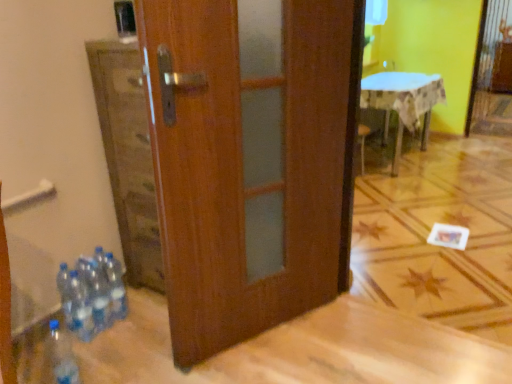
Question: Does clear plastic bottles at lower left, which appears as the second bottle when viewed from the front, lie behind clear plastic bottle at lower left, the 1th bottle viewed from the front?

Choices:
 (A) yes
 (B) no

Answer: (A)

Question: Can you confirm if clear plastic bottles at lower left, which appears as the second bottle when viewed from the front, is shorter than clear plastic bottle at lower left, the 1th bottle viewed from the front?

Choices:
 (A) no
 (B) yes

Answer: (A)

Question: Is clear plastic bottles at lower left, which appears as the second bottle when viewed from the front, positioned beyond the bounds of clear plastic bottle at lower left, the 1th bottle viewed from the front?

Choices:
 (A) yes
 (B) no

Answer: (A)

Question: Does clear plastic bottles at lower left, the 3th bottle positioned from the back, have a lesser width compared to clear plastic bottle at lower left, the 1th bottle viewed from the front?

Choices:
 (A) yes
 (B) no

Answer: (A)

Question: Considering the relative sizes of clear plastic bottles at lower left, which appears as the second bottle when viewed from the front, and clear plastic bottle at lower left, the 1th bottle viewed from the front, in the image provided, is clear plastic bottles at lower left, which appears as the second bottle when viewed from the front, smaller than clear plastic bottle at lower left, the 1th bottle viewed from the front,?

Choices:
 (A) no
 (B) yes

Answer: (B)

Question: From their relative heights in the image, would you say clear plastic bottles at lower left, which appears as the second bottle when viewed from the front, is taller or shorter than clear plastic bottles at lower left, positioned as the 3th bottle in front-to-back order?

Choices:
 (A) short
 (B) tall

Answer: (A)

Question: In the image, is clear plastic bottles at lower left, the 3th bottle positioned from the back, on the left side or the right side of clear plastic bottles at lower left, positioned as the 3th bottle in front-to-back order?

Choices:
 (A) right
 (B) left

Answer: (B)

Question: Based on their sizes in the image, would you say clear plastic bottles at lower left, which appears as the second bottle when viewed from the front, is bigger or smaller than clear plastic bottles at lower left, positioned as the 3th bottle in front-to-back order?

Choices:
 (A) small
 (B) big

Answer: (B)

Question: Relative to clear plastic bottles at lower left, which appears as the second bottle when viewed from the back, is clear plastic bottles at lower left, the 3th bottle positioned from the back, in front or behind?

Choices:
 (A) behind
 (B) front

Answer: (B)

Question: From the image's perspective, relative to clear plastic bottles at lower left, which is the 4th bottle from front to back, is clear plastic bottles at lower left, positioned as the 3th bottle in front-to-back order, above or below?

Choices:
 (A) above
 (B) below

Answer: (B)

Question: Is clear plastic bottles at lower left, which appears as the second bottle when viewed from the back, inside or outside of clear plastic bottles at lower left, which is the 4th bottle from front to back?

Choices:
 (A) outside
 (B) inside

Answer: (A)

Question: Considering their positions, is clear plastic bottles at lower left, positioned as the 3th bottle in front-to-back order, located in front of or behind clear plastic bottles at lower left, which is the 4th bottle from front to back?

Choices:
 (A) front
 (B) behind

Answer: (A)

Question: Looking at the image, does clear plastic bottles at lower left, which appears as the second bottle when viewed from the back, seem bigger or smaller compared to clear plastic bottles at lower left, acting as the 1th bottle starting from the back?

Choices:
 (A) small
 (B) big

Answer: (A)

Question: From their relative heights in the image, would you say clear plastic bottle at lower left, which ranks as the 4th bottle in back-to-front order, is taller or shorter than clear plastic bottles at lower left, positioned as the 3th bottle in front-to-back order?

Choices:
 (A) tall
 (B) short

Answer: (B)

Question: From the image's perspective, is clear plastic bottle at lower left, which ranks as the 4th bottle in back-to-front order, above or below clear plastic bottles at lower left, positioned as the 3th bottle in front-to-back order?

Choices:
 (A) below
 (B) above

Answer: (A)